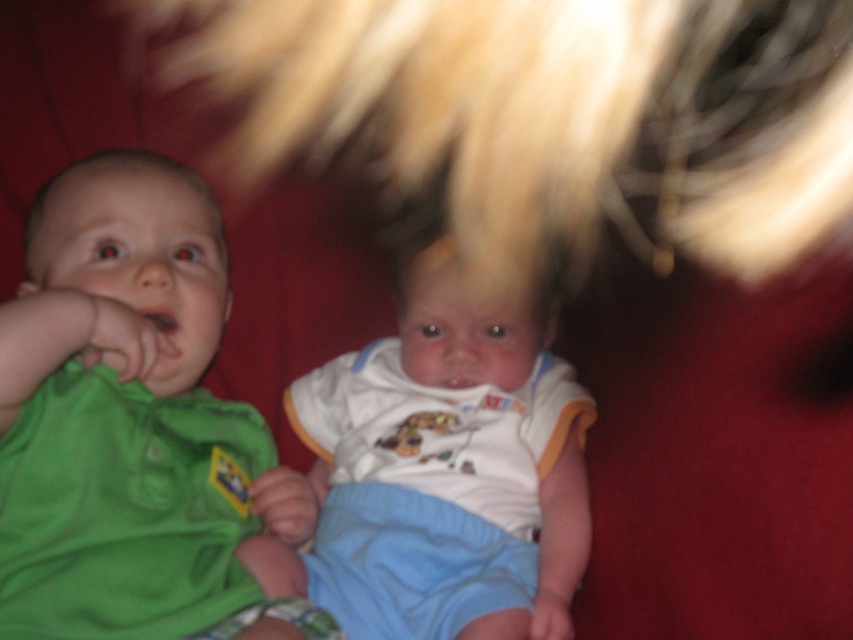
Does green fabric baby at left have a greater width compared to white cotton onesie at center?

In fact, green fabric baby at left might be narrower than white cotton onesie at center.

Is green fabric baby at left positioned in front of white cotton onesie at center?

That is True.

This screenshot has width=853, height=640. Describe the element at coordinates (126, 420) in the screenshot. I see `green fabric baby at left` at that location.

I want to click on green fabric baby at left, so click(x=126, y=420).